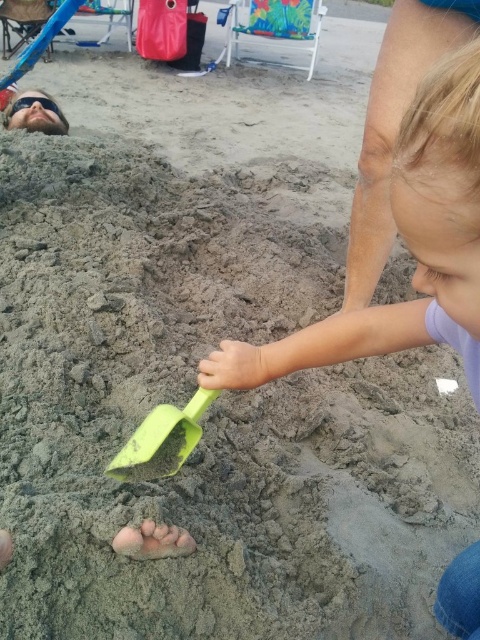
Which is more to the left, pastel purple shirt at center or green plastic shovel at center?

green plastic shovel at center

Which of these two, pastel purple shirt at center or green plastic shovel at center, stands shorter?

green plastic shovel at center

Which is in front, point (300, 355) or point (195, 410)?

Point (300, 355) is more forward.

At what (x,y) coordinates should I click in order to perform the action: click on pastel purple shirt at center. Please return your answer as a coordinate pair (x, y). Image resolution: width=480 pixels, height=640 pixels. Looking at the image, I should click on (407, 246).